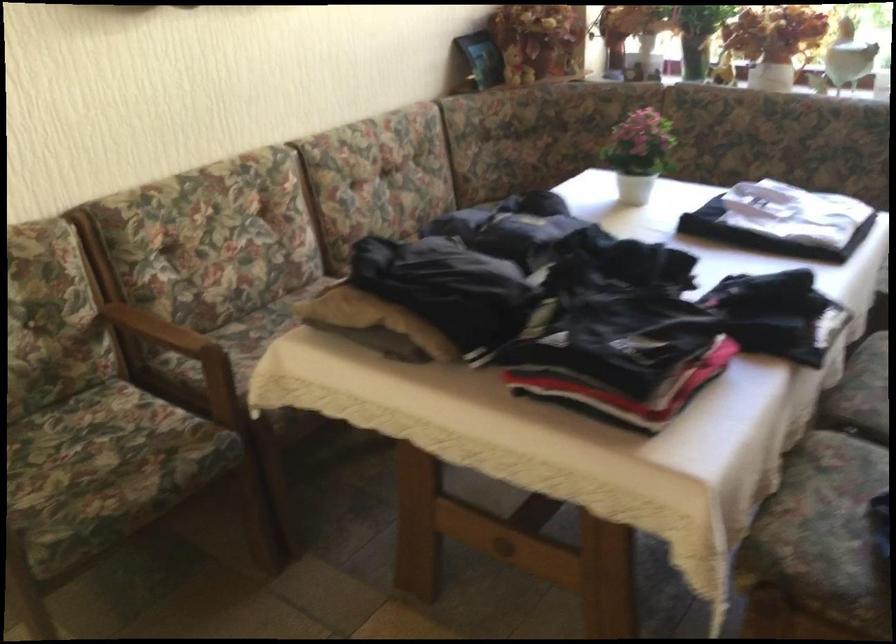
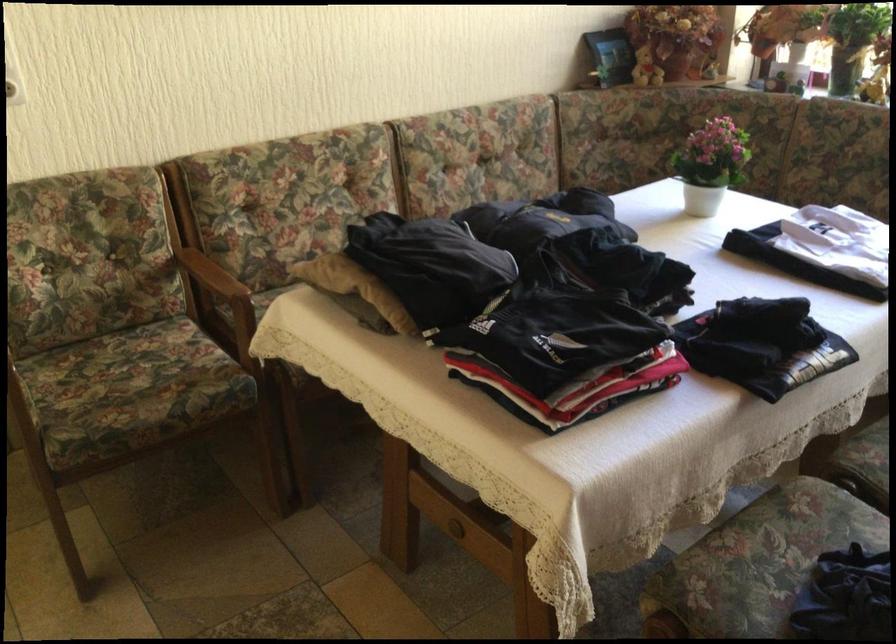
Locate, in the second image, the point that corresponds to point (97, 465) in the first image.

(130, 383)